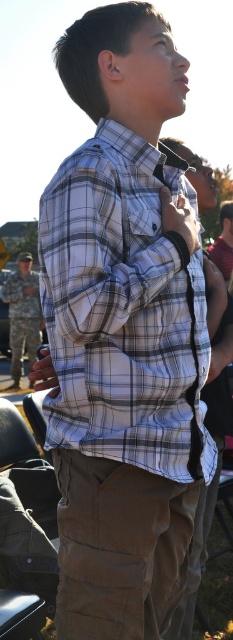
Question: Which object appears farthest from the camera in this image?

Choices:
 (A) plaid cotton shirt at center
 (B) camouflage fabric uniform at left

Answer: (B)

Question: Which object is farther from the camera taking this photo?

Choices:
 (A) camouflage fabric uniform at left
 (B) plaid cotton shirt at center

Answer: (A)

Question: Is plaid cotton shirt at center to the left of camouflage fabric uniform at left from the viewer's perspective?

Choices:
 (A) yes
 (B) no

Answer: (B)

Question: Does plaid cotton shirt at center appear under camouflage fabric uniform at left?

Choices:
 (A) yes
 (B) no

Answer: (A)

Question: Is the position of plaid cotton shirt at center more distant than that of camouflage fabric uniform at left?

Choices:
 (A) no
 (B) yes

Answer: (A)